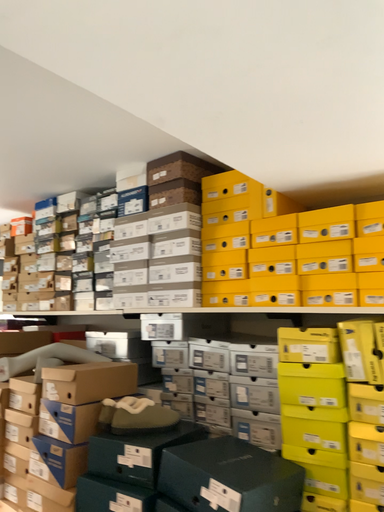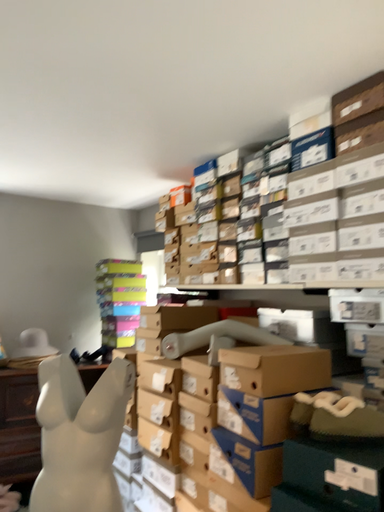
Question: How did the camera likely rotate when shooting the video?

Choices:
 (A) rotated left
 (B) rotated right

Answer: (A)